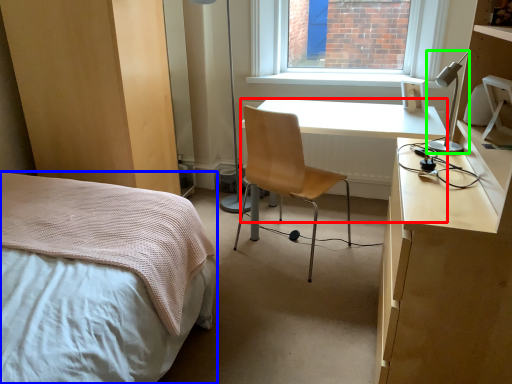
Question: Estimate the real-world distances between objects in this image. Which object is farther from desk (highlighted by a red box), bed (highlighted by a blue box) or lamp (highlighted by a green box)?

Choices:
 (A) bed
 (B) lamp

Answer: (A)